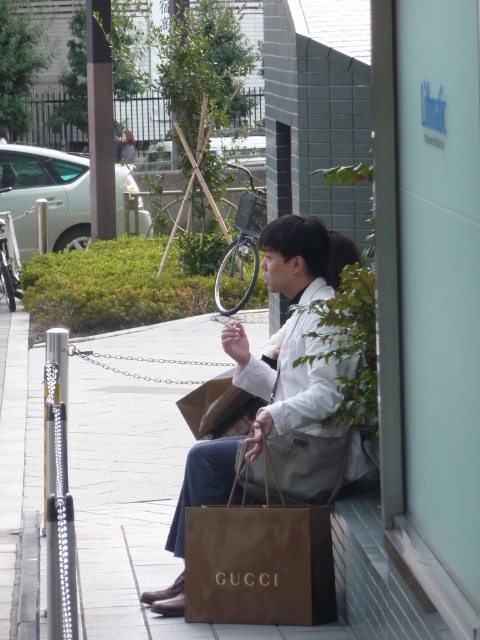
You are standing on the sidewalk and see the white matte jacket at center. If you want to reach it without moving, can you touch it with your outstretched hand?

The white matte jacket at center is 5.66 meters away from viewer, so no, you cannot touch it with your outstretched hand since it is too far away.

You are a delivery person who needs to place a package on the sidewalk. The package is 0.5 meters wide. You must place it at the location specified by the coordinates point (259, 560). Is there enough space for the package at that point?

At point (259, 560) lies brown paper bag at center. The package is 0.5 meters wide, but there is a brown paper bag already occupying that space. Therefore, there is not enough space for the package at that point.